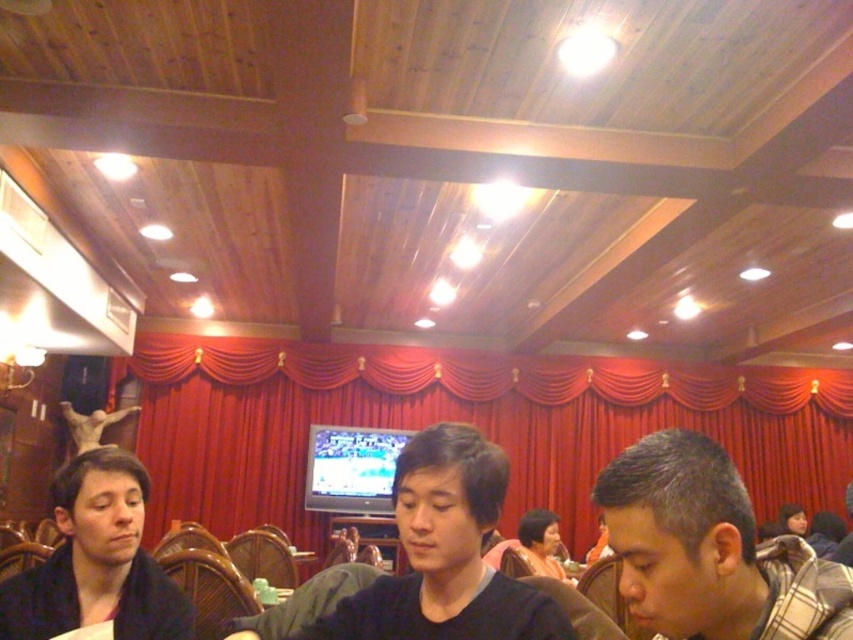
You are standing in the restaurant and want to reach the point at coordinates point (596,483). If your arm is 24 inches long, can you reach that point without moving your feet?

The point at coordinates point (596,483) is 36.21 inches away from you. Since your arm is only 24 inches long, you cannot reach it without moving your feet.

You are a photographer trying to capture a candid shot of the black matte shirt at center without including the red velvet curtain at center in the frame. Based on their positions, is this possible?

The red velvet curtain at center is positioned on the left side of black matte shirt at center, so if you position yourself to the right of the black matte shirt at center, you can capture the shot without including the curtain.

You are a fashion designer observing the scene in the image. You notice two black shirts, the black matte shirt at center and the smooth black shirt at lower left. Which one is shorter in height?

The black matte shirt at center has a lesser height compared to the smooth black shirt at lower left, so the black matte shirt at center is shorter in height.